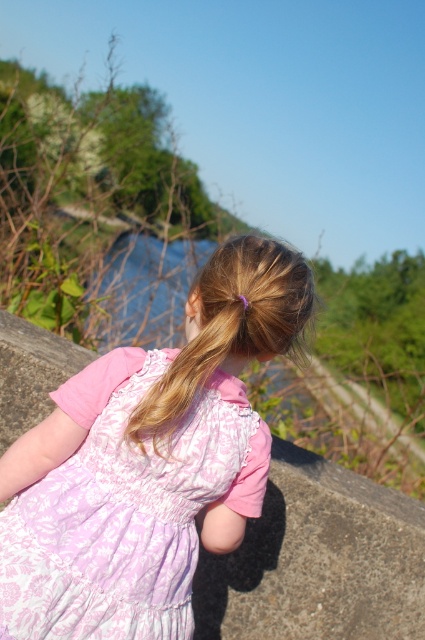
Which of these two, pink lace dress at center or blonde silky hair at center, stands taller?

With more height is pink lace dress at center.

Does pink lace dress at center appear over blonde silky hair at center?

Actually, pink lace dress at center is below blonde silky hair at center.

Between point (40, 632) and point (204, 300), which one is positioned in front?

Positioned in front is point (40, 632).

Locate an element on the screen. pink lace dress at center is located at coordinates (147, 461).